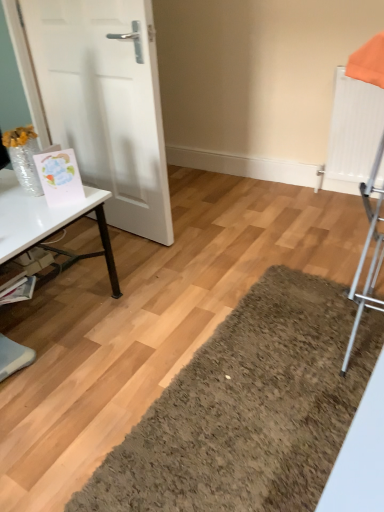
What are the coordinates of `white glossy table at left` in the screenshot? It's located at (48, 225).

Measure the distance between point (27, 244) and camera.

Point (27, 244) is 1.35 meters from camera.

Image resolution: width=384 pixels, height=512 pixels. What do you see at coordinates (48, 225) in the screenshot? I see `white glossy table at left` at bounding box center [48, 225].

Where is `white matte door at left`? This screenshot has height=512, width=384. white matte door at left is located at coordinates (106, 102).

This screenshot has height=512, width=384. What do you see at coordinates (106, 102) in the screenshot?
I see `white matte door at left` at bounding box center [106, 102].

You are a GUI agent. You are given a task and a screenshot of the screen. Output one action in this format:
    pyautogui.click(x=<x>, y=<y>)
    Task: Click on the white glossy table at left
    This screenshot has width=384, height=512.
    Given the screenshot: What is the action you would take?
    pyautogui.click(x=48, y=225)

Is white matte door at left to the left of white glossy table at left from the viewer's perspective?

No, white matte door at left is not to the left of white glossy table at left.

Which is in front, white matte door at left or white glossy table at left?

white glossy table at left is more forward.

Is point (137, 61) closer to camera compared to point (67, 260)?

Yes, it is in front of point (67, 260).

From the image's perspective, which is above, white matte door at left or white glossy table at left?

From the image's view, white matte door at left is above.

From a real-world perspective, which object rests below the other?

From a 3D spatial view, white glossy table at left is below.

Considering the relative sizes of white matte door at left and white glossy table at left in the image provided, is white matte door at left wider than white glossy table at left?

No, white matte door at left is not wider than white glossy table at left.

In terms of height, does white matte door at left look taller or shorter compared to white glossy table at left?

Considering their sizes, white matte door at left has more height than white glossy table at left.

Considering the sizes of objects white matte door at left and white glossy table at left in the image provided, who is smaller, white matte door at left or white glossy table at left?

white matte door at left.

Do you think white matte door at left is within white glossy table at left, or outside of it?

white matte door at left cannot be found inside white glossy table at left.

Is white matte door at left with white glossy table at left?

No.

Is white matte door at left positioned with its back to white glossy table at left?

Yes, white matte door at left's orientation is away from white glossy table at left.

Can you tell me how much white matte door at left and white glossy table at left differ in facing direction?

The angle between the facing direction of white matte door at left and the facing direction of white glossy table at left is 83.3 degrees.

This screenshot has width=384, height=512. I want to click on table below the white matte door at left (from the image's perspective), so click(x=48, y=225).

Between white glossy table at left and white matte door at left, which one appears on the left side from the viewer's perspective?

white glossy table at left.

Between white glossy table at left and white matte door at left, which one is positioned behind?

white matte door at left is further from the camera.

Which is behind, point (113, 256) or point (111, 21)?

The point (113, 256) is more distant.

From the image's perspective, is white glossy table at left located above or below white matte door at left?

From the image's perspective, white glossy table at left appears below white matte door at left.

From a real-world perspective, is white glossy table at left under white matte door at left?

Yes.

Considering the sizes of white glossy table at left and white matte door at left in the image, is white glossy table at left wider or thinner than white matte door at left?

white glossy table at left is wider than white matte door at left.

Who is shorter, white glossy table at left or white matte door at left?

Standing shorter between the two is white glossy table at left.

Considering the sizes of objects white glossy table at left and white matte door at left in the image provided, who is smaller, white glossy table at left or white matte door at left?

With smaller size is white matte door at left.

Is white glossy table at left inside the boundaries of white matte door at left, or outside?

white glossy table at left cannot be found inside white matte door at left.

Is white glossy table at left far away from white matte door at left?

white glossy table at left is actually quite close to white matte door at left.

Could you tell me if white glossy table at left is turned towards white matte door at left?

No, white glossy table at left is not turned towards white matte door at left.

The height and width of the screenshot is (512, 384). Identify the location of door above the white glossy table at left (from the image's perspective). (106, 102).

Where is `table below the white matte door at left (from the image's perspective)`? This screenshot has width=384, height=512. table below the white matte door at left (from the image's perspective) is located at coordinates (48, 225).

This screenshot has width=384, height=512. Find the location of `door that appears on the right of white glossy table at left`. door that appears on the right of white glossy table at left is located at coordinates (106, 102).